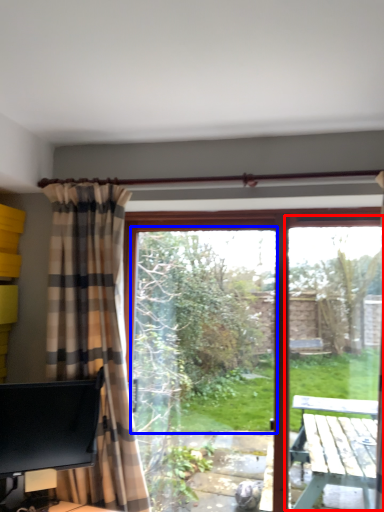
Question: Which point is closer to the camera, screen door (highlighted by a red box) or window screen (highlighted by a blue box)?

Choices:
 (A) screen door
 (B) window screen

Answer: (A)